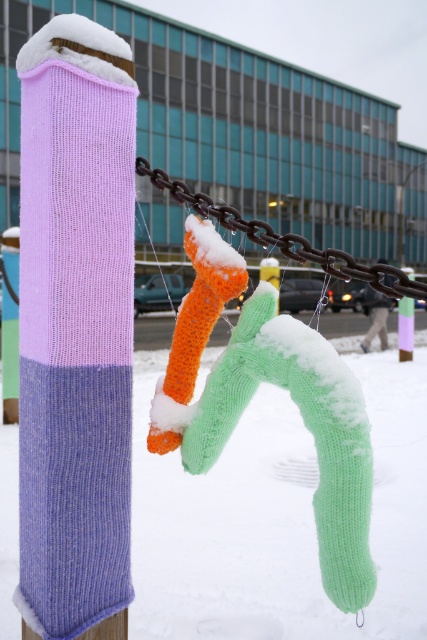
Question: Can you confirm if purple knitted sock at left is positioned above rusty metal chain at center?

Choices:
 (A) yes
 (B) no

Answer: (B)

Question: Which point is closer to the camera taking this photo?

Choices:
 (A) (224, 268)
 (B) (251, 220)

Answer: (A)

Question: Can you confirm if green knitted sock at center is thinner than orange knitted sock at center?

Choices:
 (A) no
 (B) yes

Answer: (A)

Question: Does orange knitted sock at center have a larger size compared to rusty metal chain at center?

Choices:
 (A) yes
 (B) no

Answer: (A)

Question: Which point appears farthest from the camera in this image?

Choices:
 (A) (228, 294)
 (B) (81, 48)
 (C) (213, 212)

Answer: (C)

Question: Which object appears closest to the camera in this image?

Choices:
 (A) rusty metal chain at center
 (B) green knitted sock at center

Answer: (B)